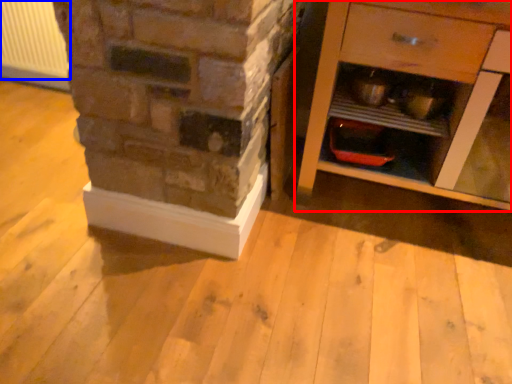
Question: Among these objects, which one is nearest to the camera, chest of drawers (highlighted by a red box) or radiator (highlighted by a blue box)?

Choices:
 (A) chest of drawers
 (B) radiator

Answer: (A)